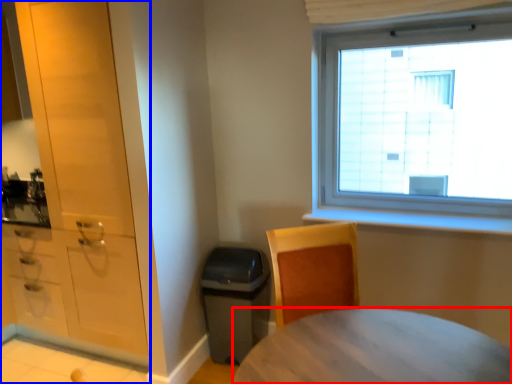
Question: Which object is closer to the camera taking this photo, desk (highlighted by a red box) or cabinetry (highlighted by a blue box)?

Choices:
 (A) desk
 (B) cabinetry

Answer: (A)